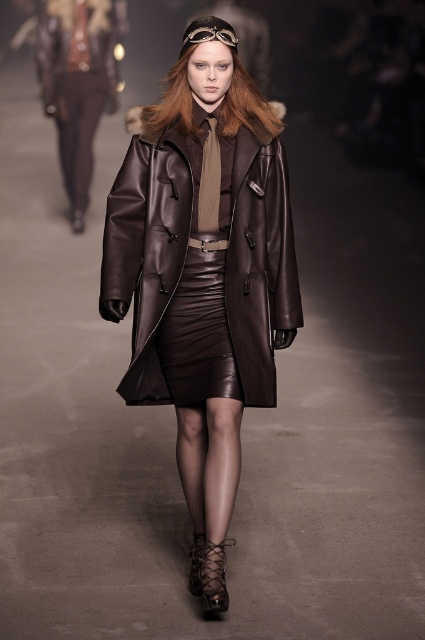
Question: Does matte leather trench coat at center have a lesser width compared to matte brown leather pants at left?

Choices:
 (A) yes
 (B) no

Answer: (B)

Question: Among these points, which one is farthest from the camera?

Choices:
 (A) (91, 13)
 (B) (127, 394)

Answer: (A)

Question: Is matte leather trench coat at center smaller than matte brown leather pants at left?

Choices:
 (A) no
 (B) yes

Answer: (B)

Question: Which point appears closest to the camera in this image?

Choices:
 (A) (163, 381)
 (B) (99, 97)
 (C) (45, 70)

Answer: (A)

Question: Which object is the closest to the matte brown leather pants at left?

Choices:
 (A) matte leather trench coat at center
 (B) matte leather pants at center

Answer: (B)

Question: Does matte leather pants at center have a lesser width compared to matte brown leather pants at left?

Choices:
 (A) no
 (B) yes

Answer: (B)